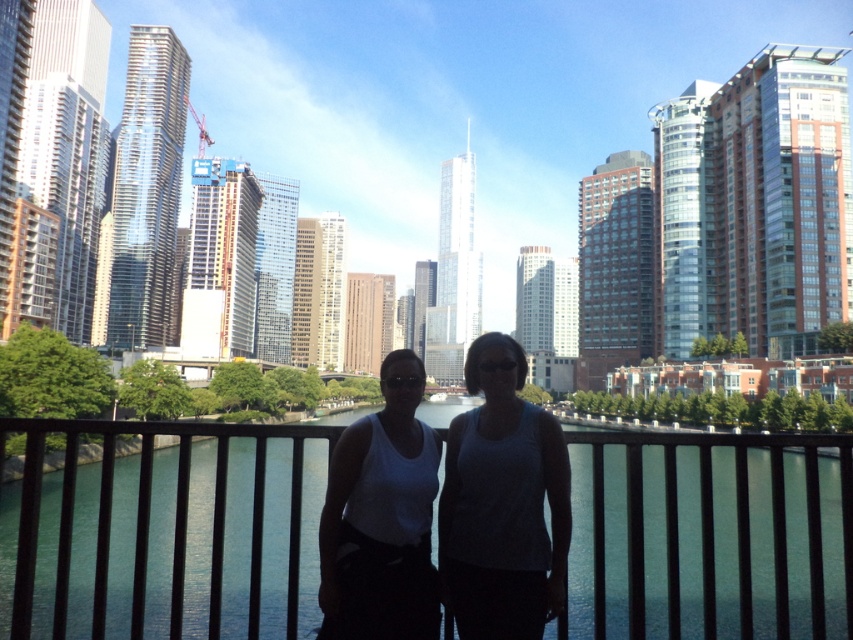
Question: Can you confirm if black metal fence at center is positioned above white fabric tank top at center?

Choices:
 (A) yes
 (B) no

Answer: (B)

Question: Can you confirm if white fabric tank top at center is smaller than white matte tank top at center?

Choices:
 (A) no
 (B) yes

Answer: (B)

Question: Which point appears farthest from the camera in this image?

Choices:
 (A) (634, 560)
 (B) (399, 451)
 (C) (386, 518)

Answer: (B)

Question: Which point is closer to the camera?

Choices:
 (A) (393, 412)
 (B) (405, 378)

Answer: (A)

Question: Which object appears closest to the camera in this image?

Choices:
 (A) white matte tank top at center
 (B) white fabric tank top at center

Answer: (A)

Question: Does black metal fence at center appear on the right side of white fabric tank top at center?

Choices:
 (A) yes
 (B) no

Answer: (A)